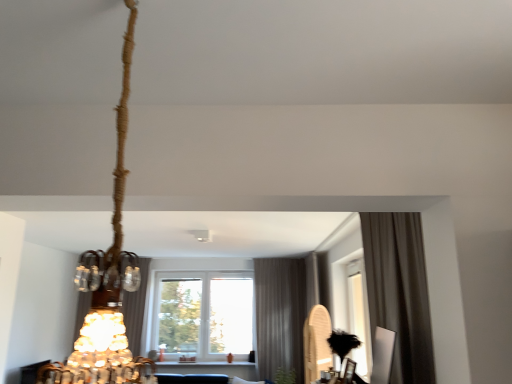
Question: Is satin brown curtain at center, which is counted as the 3th curtain, starting from the front, bigger than brown fabric curtain at right, placed as the first curtain when sorted from right to left?

Choices:
 (A) no
 (B) yes

Answer: (B)

Question: Does satin brown curtain at center, which is counted as the 3th curtain, starting from the front, contain brown fabric curtain at right, which is counted as the 1th curtain, starting from the front?

Choices:
 (A) no
 (B) yes

Answer: (A)

Question: Is satin brown curtain at center, placed as the first curtain when sorted from left to right, wider than brown fabric curtain at right, which is counted as the 1th curtain, starting from the front?

Choices:
 (A) no
 (B) yes

Answer: (B)

Question: From the image's perspective, is satin brown curtain at center, which is counted as the 3th curtain, starting from the front, on top of brown fabric curtain at right, which is counted as the 1th curtain, starting from the front?

Choices:
 (A) yes
 (B) no

Answer: (B)

Question: Can you confirm if satin brown curtain at center, placed as the first curtain when sorted from left to right, is shorter than brown fabric curtain at right, which is counted as the 1th curtain, starting from the front?

Choices:
 (A) yes
 (B) no

Answer: (B)

Question: Is braided rope chandelier at upper left taller or shorter than transparent glass window at center?

Choices:
 (A) tall
 (B) short

Answer: (B)

Question: From a real-world perspective, is braided rope chandelier at upper left positioned above or below transparent glass window at center?

Choices:
 (A) below
 (B) above

Answer: (B)

Question: Is point [x=100, y=370] closer or farther from the camera than point [x=190, y=284]?

Choices:
 (A) closer
 (B) farther

Answer: (A)

Question: From the image's perspective, is braided rope chandelier at upper left above or below transparent glass window at center?

Choices:
 (A) below
 (B) above

Answer: (B)

Question: Is green leafy plant at lower center wider or thinner than wooden paddle at right?

Choices:
 (A) wide
 (B) thin

Answer: (A)

Question: From a real-world perspective, is green leafy plant at lower center above or below wooden paddle at right?

Choices:
 (A) above
 (B) below

Answer: (B)

Question: Based on their positions, is green leafy plant at lower center located to the left or right of wooden paddle at right?

Choices:
 (A) right
 (B) left

Answer: (B)

Question: Choose the correct answer: Is green leafy plant at lower center inside wooden paddle at right or outside it?

Choices:
 (A) outside
 (B) inside

Answer: (A)

Question: Visually, is transparent glass window at center positioned to the left or to the right of gray textured curtain at center, the 2th curtain from the back?

Choices:
 (A) left
 (B) right

Answer: (A)

Question: Which is correct: transparent glass window at center is inside gray textured curtain at center, the 2th curtain when ordered from left to right, or outside of it?

Choices:
 (A) inside
 (B) outside

Answer: (B)